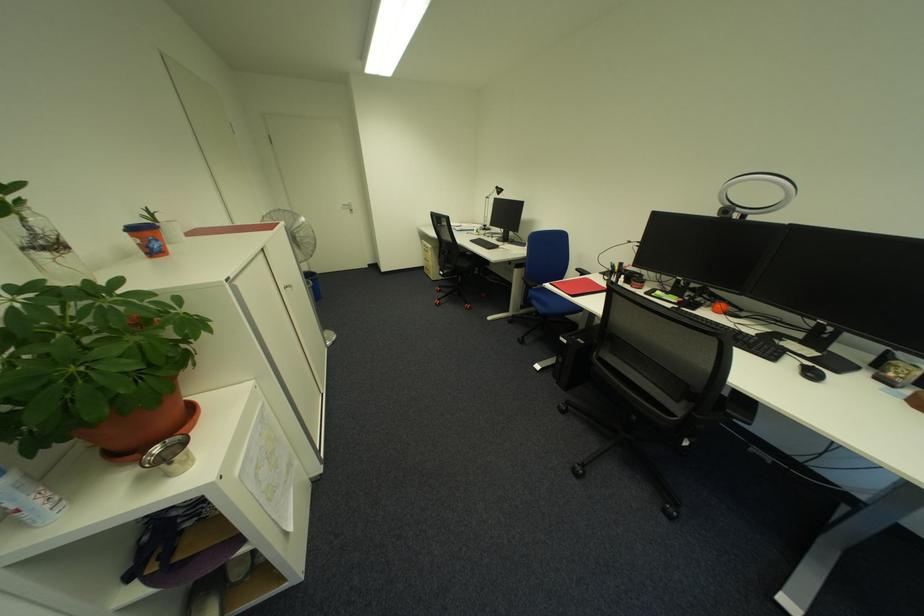
Find where to turn the silver door handle. Please return your answer as a coordinate pair (x, y).

(347, 207)